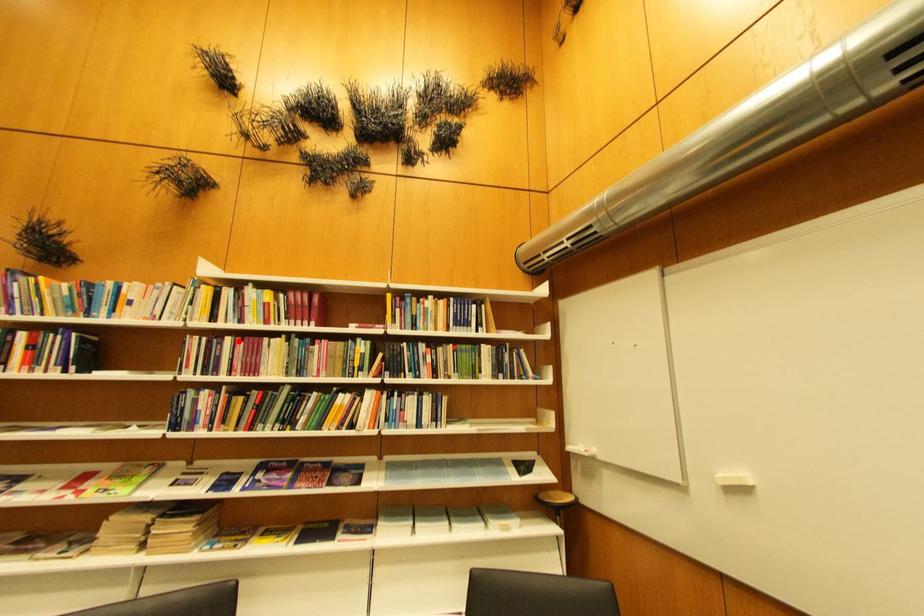
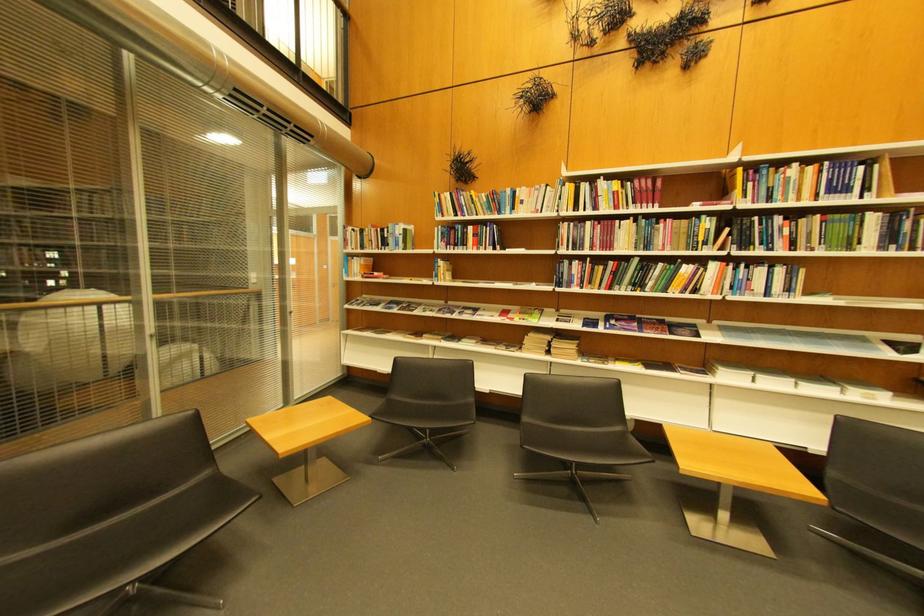
Where in the second image is the point corresponding to the highlighted location from the first image?

(600, 225)